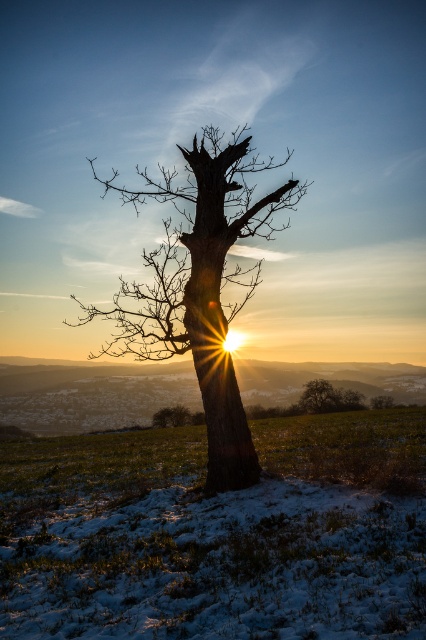
Question: Among these objects, which one is farthest from the camera?

Choices:
 (A) snowy grass at center
 (B) smooth brown tree at center
 (C) dark brown bark tree at center
 (D) smooth bark tree trunk at center

Answer: (B)

Question: Does smooth brown tree at center appear under smooth brown tree trunk at center?

Choices:
 (A) yes
 (B) no

Answer: (B)

Question: Does smooth bark tree trunk at center appear on the right side of smooth brown tree at center?

Choices:
 (A) yes
 (B) no

Answer: (B)

Question: Does dark brown bark tree at center appear on the right side of smooth bark tree trunk at center?

Choices:
 (A) no
 (B) yes

Answer: (A)

Question: Which point appears farthest from the camera in this image?

Choices:
 (A) (224, 595)
 (B) (319, 397)

Answer: (B)

Question: Estimate the real-world distances between objects in this image. Which object is farther from the smooth bark tree trunk at center?

Choices:
 (A) smooth brown tree trunk at center
 (B) dark brown bark tree at center
 (C) smooth brown tree at center
 (D) snowy grass at center

Answer: (C)